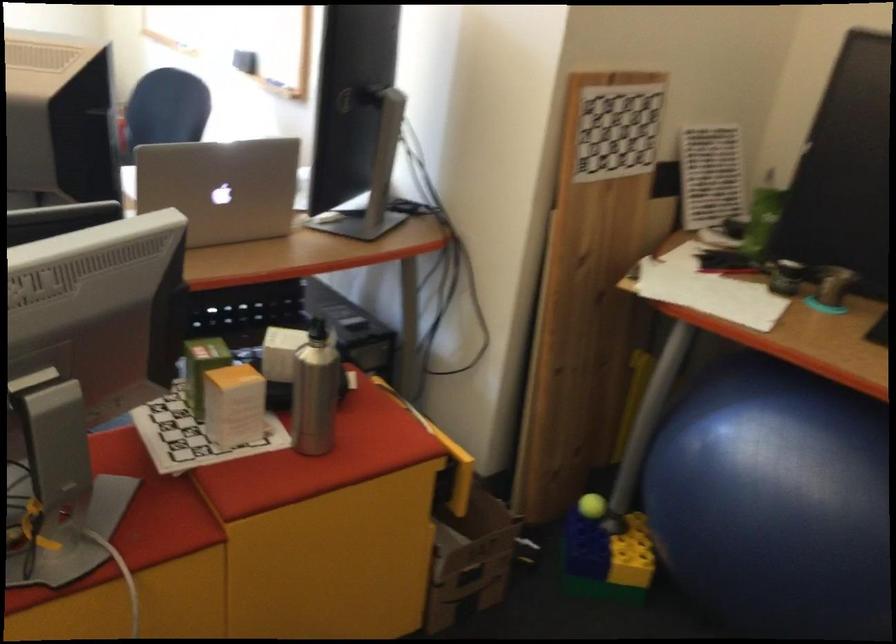
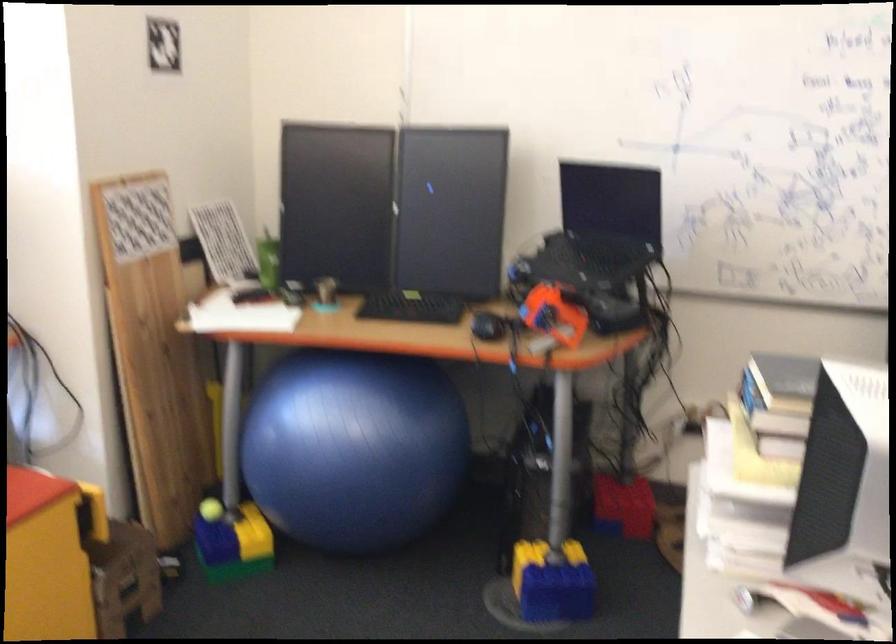
Where in the second image is the point corresponding to [583,507] from the first image?

(211, 509)